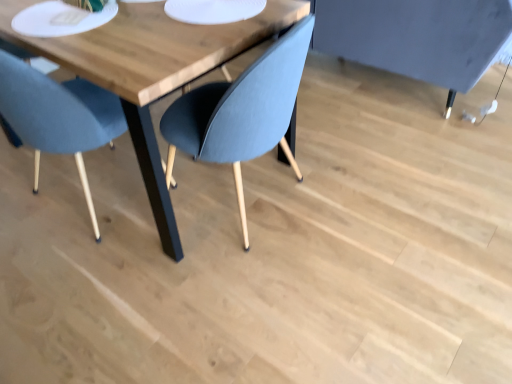
Question: Is white matte platter at upper left smaller than wooden table at center?

Choices:
 (A) yes
 (B) no

Answer: (A)

Question: Is white matte platter at upper left completely or partially outside of wooden table at center?

Choices:
 (A) no
 (B) yes

Answer: (A)

Question: From the image's perspective, is white matte platter at upper left below wooden table at center?

Choices:
 (A) yes
 (B) no

Answer: (B)

Question: Does white matte platter at upper left touch wooden table at center?

Choices:
 (A) no
 (B) yes

Answer: (A)

Question: Considering the relative sizes of white matte platter at upper left and wooden table at center in the image provided, is white matte platter at upper left taller than wooden table at center?

Choices:
 (A) yes
 (B) no

Answer: (B)

Question: From a real-world perspective, is white matte platter at upper left positioned under wooden table at center based on gravity?

Choices:
 (A) yes
 (B) no

Answer: (B)

Question: Is white matte platter at upper left at the right side of white matte paper plate at upper center?

Choices:
 (A) no
 (B) yes

Answer: (A)

Question: Is white matte paper plate at upper center at the back of white matte platter at upper left?

Choices:
 (A) yes
 (B) no

Answer: (B)

Question: Is white matte platter at upper left far away from white matte paper plate at upper center?

Choices:
 (A) no
 (B) yes

Answer: (A)

Question: From a real-world perspective, is white matte platter at upper left physically above white matte paper plate at upper center?

Choices:
 (A) yes
 (B) no

Answer: (B)

Question: Does white matte platter at upper left come behind white matte paper plate at upper center?

Choices:
 (A) yes
 (B) no

Answer: (B)

Question: Is white matte paper plate at upper center a part of white matte platter at upper left?

Choices:
 (A) yes
 (B) no

Answer: (B)

Question: Considering the relative sizes of matte blue chair at left and wooden table at center in the image provided, is matte blue chair at left smaller than wooden table at center?

Choices:
 (A) no
 (B) yes

Answer: (B)